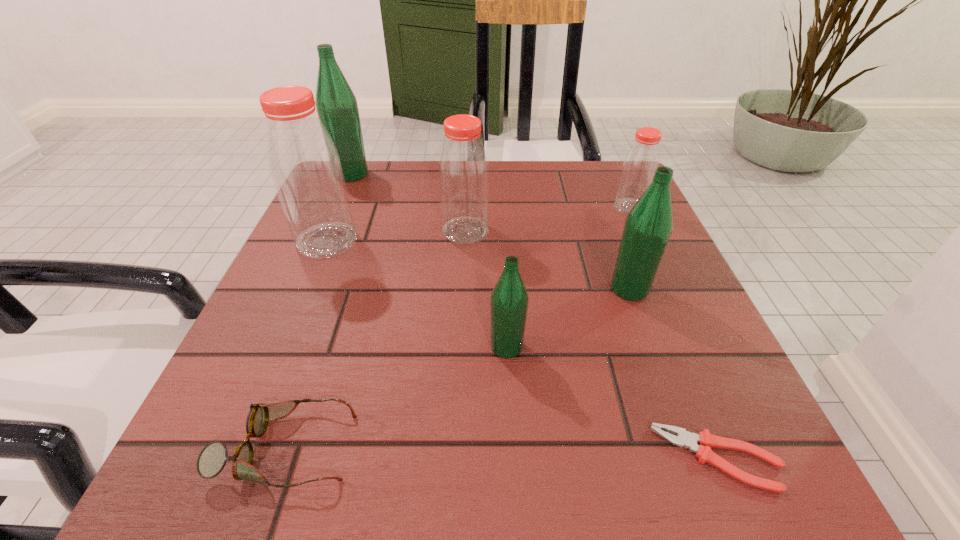
You are a GUI agent. You are given a task and a screenshot of the screen. Output one action in this format:
    pyautogui.click(x=<x>, y=<y>)
    Task: Click on the vacant area that lies between the spectacles and the farthest object
    The image size is (960, 540).
    Given the screenshot: What is the action you would take?
    pyautogui.click(x=318, y=311)

Locate an element on the screen. free space between the farthest object and the shortest object is located at coordinates (535, 316).

I want to click on vacant space in between the smallest red bottle and the nearest bottle, so click(x=568, y=277).

The height and width of the screenshot is (540, 960). I want to click on object that is the third closest to the second red bottle from left to right, so point(648,226).

Find the location of a particular element. object that stands as the fourth closest to the fourth nearest object is located at coordinates (706, 440).

Identify the location of bottle that can be found as the fifth closest to the smallest red bottle. (337, 108).

This screenshot has height=540, width=960. Find the location of `the fifth closest bottle to the spectacles`. the fifth closest bottle to the spectacles is located at coordinates (337, 108).

Identify which green bottle is the second closest to the farthest green bottle. Please provide its 2D coordinates. Your answer should be formatted as a tuple, i.e. [(x, y)], where the tuple contains the x and y coordinates of a point satisfying the conditions above.

[(648, 226)]

Select which green bottle is the third closest to the rightmost red bottle. Please provide its 2D coordinates. Your answer should be formatted as a tuple, i.e. [(x, y)], where the tuple contains the x and y coordinates of a point satisfying the conditions above.

[(337, 108)]

What are the coordinates of `red bottle that is the nearest to the second biggest red bottle` in the screenshot? It's located at (305, 167).